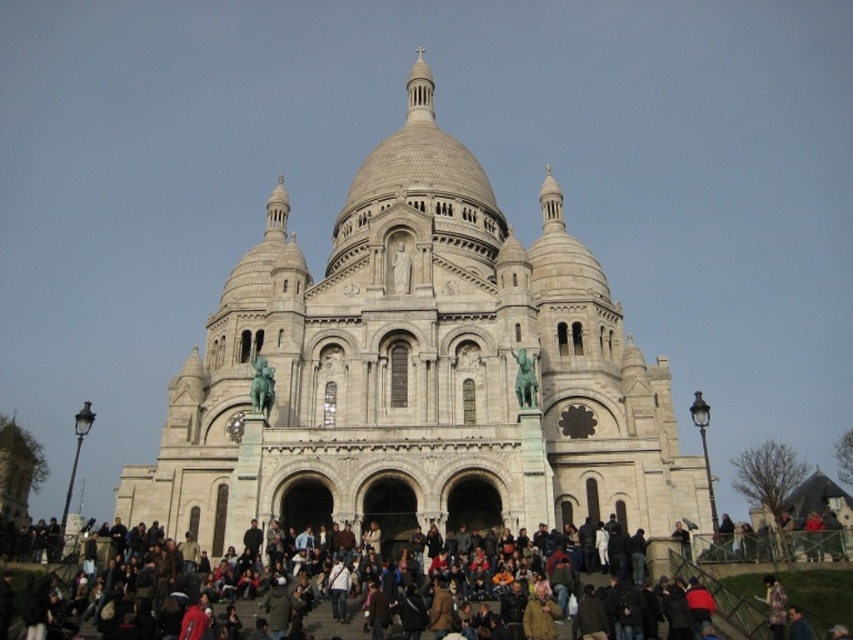
Question: Which of the following is the closest to the observer?

Choices:
 (A) (618, 432)
 (B) (753, 621)

Answer: (B)

Question: Can you confirm if white stone church at center is positioned to the right of multicolored clothing at lower center?

Choices:
 (A) yes
 (B) no

Answer: (B)

Question: Is white stone church at center thinner than multicolored clothing at lower center?

Choices:
 (A) yes
 (B) no

Answer: (B)

Question: Which object is farther from the camera taking this photo?

Choices:
 (A) multicolored clothing at lower center
 (B) white stone church at center

Answer: (B)

Question: Observing the image, what is the correct spatial positioning of white stone church at center in reference to multicolored clothing at lower center?

Choices:
 (A) above
 (B) below

Answer: (A)